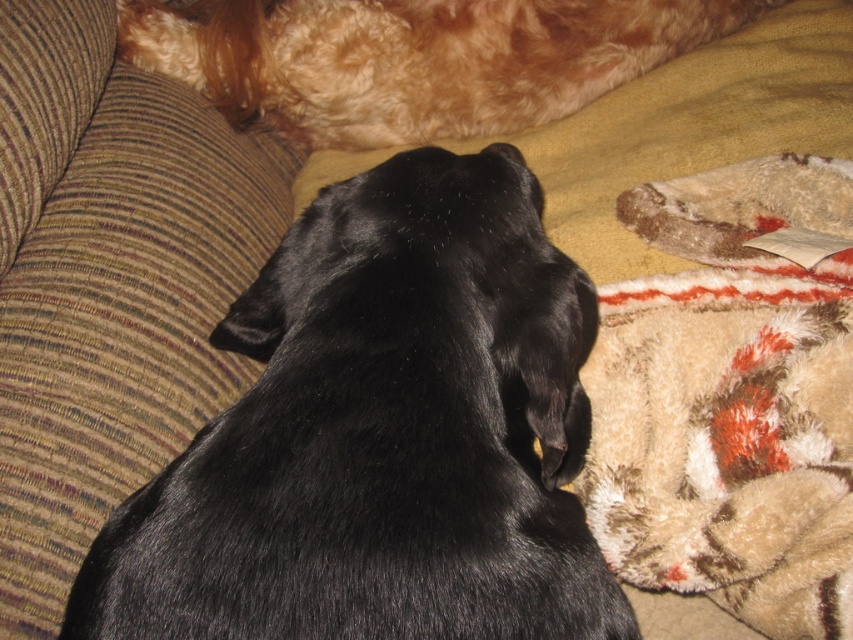
Based on the photo, you are trying to decide whether to place a new rectangular pillow on the couch. The pillow is 1.2 meters wide. You see the black fur dog at center and the fuzzy beige blanket at lower right. Which object, if any, might the pillow not fit next to due to width?

The black fur dog at center might be wider than the fuzzy beige blanket at lower right. Since the pillow is 1.2 meters wide, it might not fit next to the black fur dog at center if the dog is wider than the blanket.

You are a photographer setting up a shot of the black fur dog at center and the fuzzy beige blanket at lower right. Which object is shorter in the scene?

The black fur dog at center is shorter than the fuzzy beige blanket at lower right.

You are a pet sitter who needs to cover both dogs with a blanket. Given the positions of the fuzzy beige blanket at lower right and the golden fur dog at upper center, can you reach the blanket from where the golden fur dog is located?

The fuzzy beige blanket at lower right is located below the golden fur dog at upper center, so yes, the blanket can be reached from the position of the golden fur dog at upper center by moving downward.